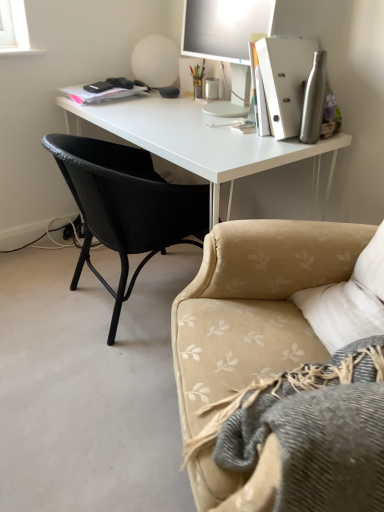
Locate an element on the screen. The image size is (384, 512). vacant space in front of black woven chair at left is located at coordinates (86, 393).